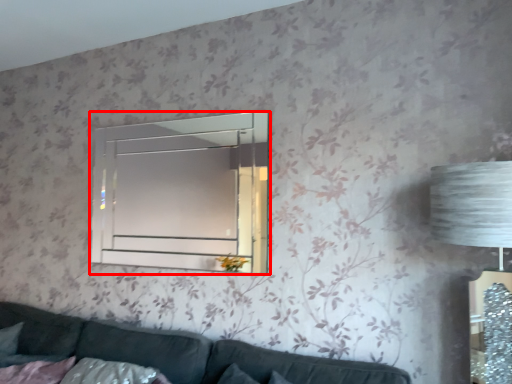
Question: From the image's perspective, where is window (annotated by the red box) located in relation to studio couch in the image?

Choices:
 (A) below
 (B) above

Answer: (B)